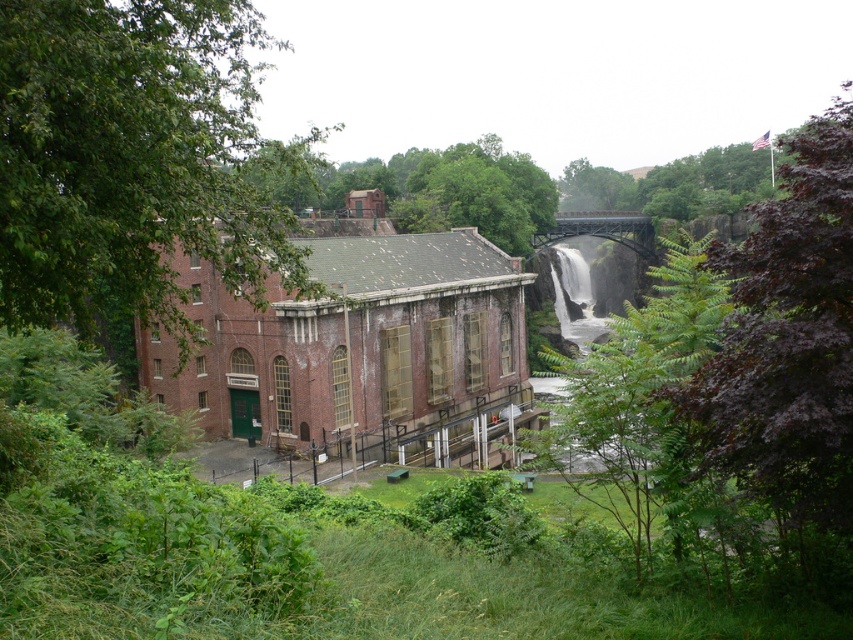
You are a hiker carrying a 20 meter long rope. You want to tie the green leafy tree at left to the purple leafy tree at upper right. Can you do it with the rope you have?

The distance between the green leafy tree at left and the purple leafy tree at upper right is 21.30 meters. Since the rope is only 20 meters long, it is not long enough to reach between them.

You are a landscape architect planning to plant a new tree in this area. You have a small sapling that needs space to grow. Which tree among the green leafy tree at left and the purple leafy tree at upper right would you consider for the sapling to ensure it has enough space to grow without overcrowding?

The purple leafy tree at upper right is larger in size, so planting the sapling near it might provide more space for growth compared to the smaller green leafy tree at left.

You are standing in front of the red brick building at center. If you want to take a photo of the building with the waterfall in the background, where should you position yourself relative to the building?

Since the red brick building at center is located at point (352, 342) in the image, you should position yourself to the left or right side of the building to ensure the waterfall is visible in the background for the photo.